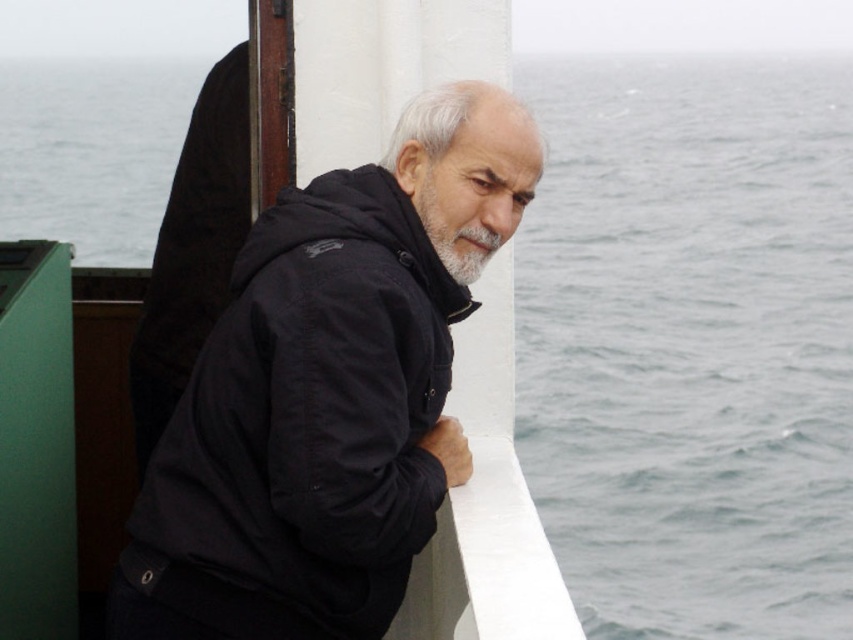
Does point (700, 280) come farther from viewer compared to point (332, 385)?

Yes.

Does gray water at upper right have a larger size compared to black fabric jacket at center?

Correct, gray water at upper right is larger in size than black fabric jacket at center.

Locate an element on the screen. gray water at upper right is located at coordinates (691, 342).

Where is `gray water at upper right`? The height and width of the screenshot is (640, 853). gray water at upper right is located at coordinates (691, 342).

Between gray water at upper right and gray matte beard at center, which one has more height?

gray water at upper right

Measure the distance between gray water at upper right and camera.

3.63 meters

In order to click on gray water at upper right in this screenshot , I will do `click(691, 342)`.

Who is more forward, (280, 387) or (459, 172)?

Positioned in front is point (280, 387).

Can you confirm if black fabric jacket at center is smaller than gray matte beard at center?

Actually, black fabric jacket at center might be larger than gray matte beard at center.

Who is more forward, [264,216] or [433,195]?

Point [264,216] is more forward.

The width and height of the screenshot is (853, 640). Identify the location of black fabric jacket at center. (315, 406).